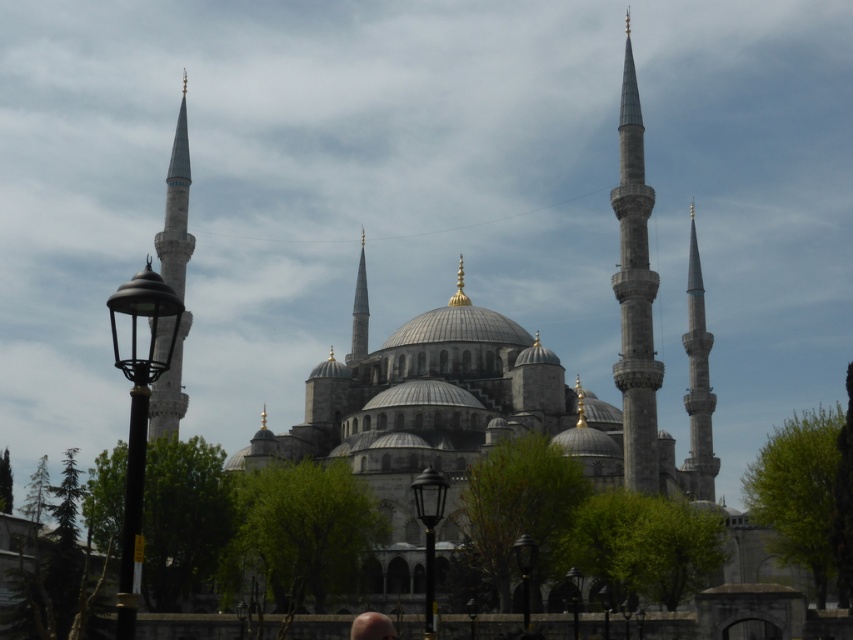
Question: Is gray stone minaret at center-right to the left of smooth stone minaret at center from the viewer's perspective?

Choices:
 (A) yes
 (B) no

Answer: (B)

Question: Can you confirm if gray stone minaret at center-right is bigger than smooth stone minaret at center?

Choices:
 (A) no
 (B) yes

Answer: (B)

Question: Which of the following is the farthest from the observer?

Choices:
 (A) smooth skin head at lower center
 (B) gray stone minaret at left

Answer: (A)

Question: Which object is closer to the camera taking this photo?

Choices:
 (A) gray stone minaret at center-right
 (B) smooth skin head at lower center

Answer: (B)

Question: Considering the real-world distances, which object is farthest from the smooth skin head at lower center?

Choices:
 (A) gray stone minaret at center-right
 (B) gray stone spire at right

Answer: (B)

Question: Is gray stone minaret at left to the right of gray stone spire at right from the viewer's perspective?

Choices:
 (A) no
 (B) yes

Answer: (A)